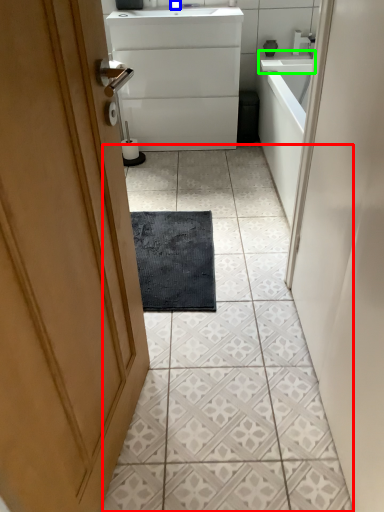
Question: Which is farther away from ceramic tile (highlighted by a red box)? faucet (highlighted by a blue box) or counter top (highlighted by a green box)?

Choices:
 (A) faucet
 (B) counter top

Answer: (A)